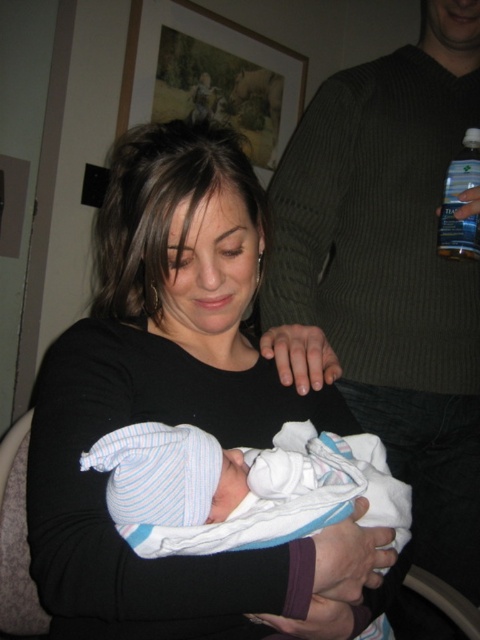
From the picture: Who is shorter, black matte shirt at center or clear plastic bottle at upper right?

Standing shorter between the two is clear plastic bottle at upper right.

Identify the location of black matte shirt at center. (177, 406).

Can you confirm if black matte shirt at center is bigger than striped knit hat at center?

Yes, black matte shirt at center is bigger than striped knit hat at center.

Find the location of a particular element. black matte shirt at center is located at coordinates (177, 406).

Between black matte shirt at center and ribbed sweater at upper right, which one has less height?

With less height is black matte shirt at center.

In the scene shown: Between black matte shirt at center and ribbed sweater at upper right, which one is positioned higher?

Result: ribbed sweater at upper right

This screenshot has width=480, height=640. Describe the element at coordinates (177, 406) in the screenshot. I see `black matte shirt at center` at that location.

Image resolution: width=480 pixels, height=640 pixels. What are the coordinates of `black matte shirt at center` in the screenshot? It's located at (177, 406).